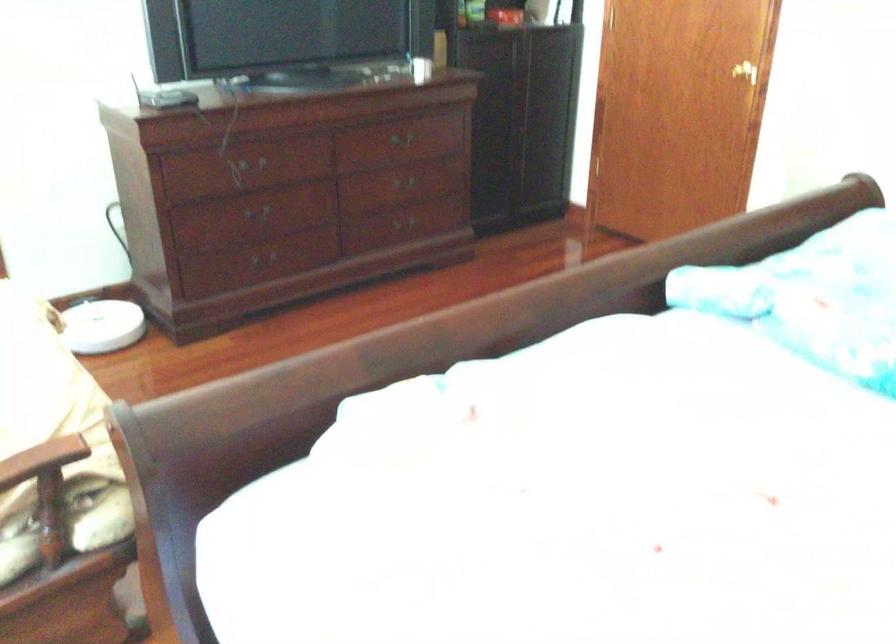
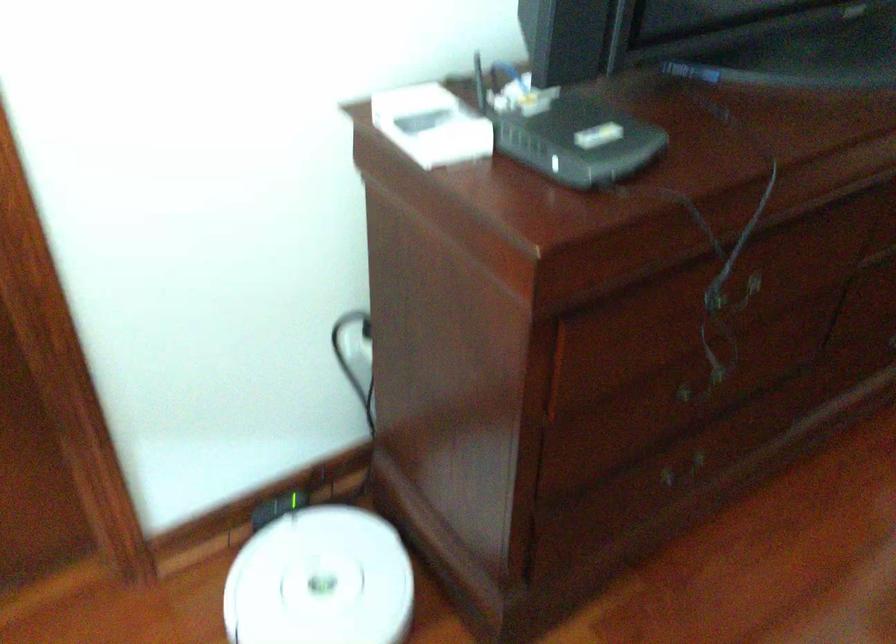
Find the pixel in the second image that matches point (263, 219) in the first image.

(702, 384)